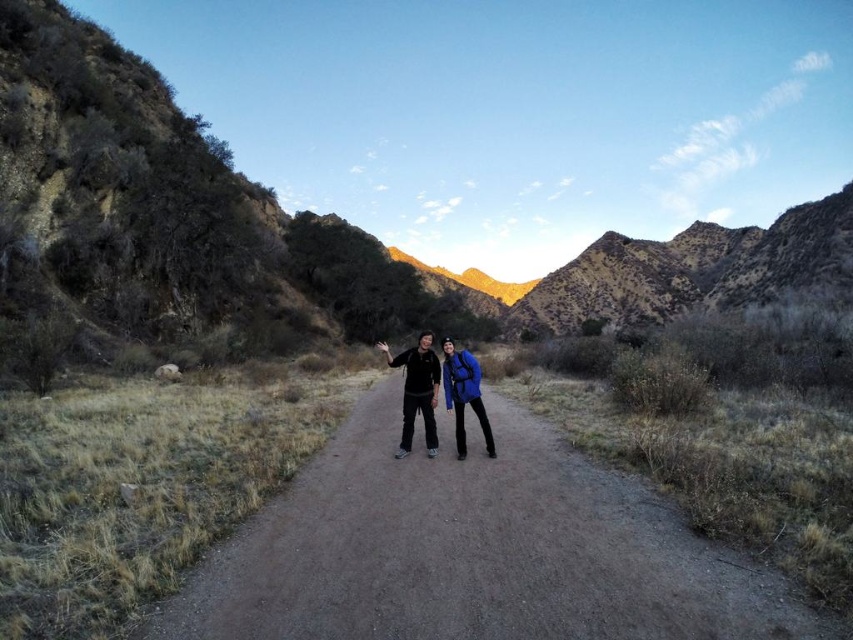
You are a hiker carrying a backpack and see the brown rocky mountain at center and the matte black jacket at center. Which object is wider?

The brown rocky mountain at center is wider than the matte black jacket at center.